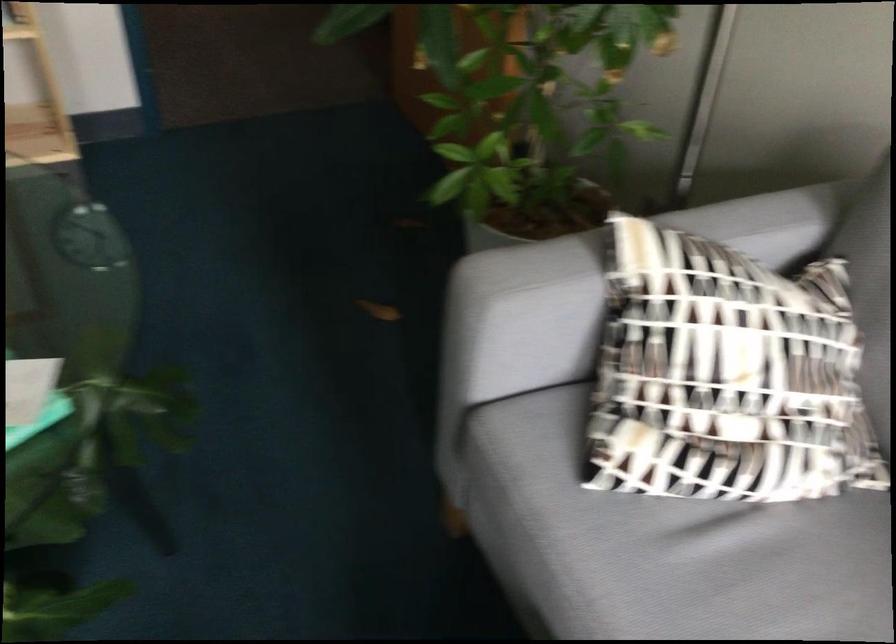
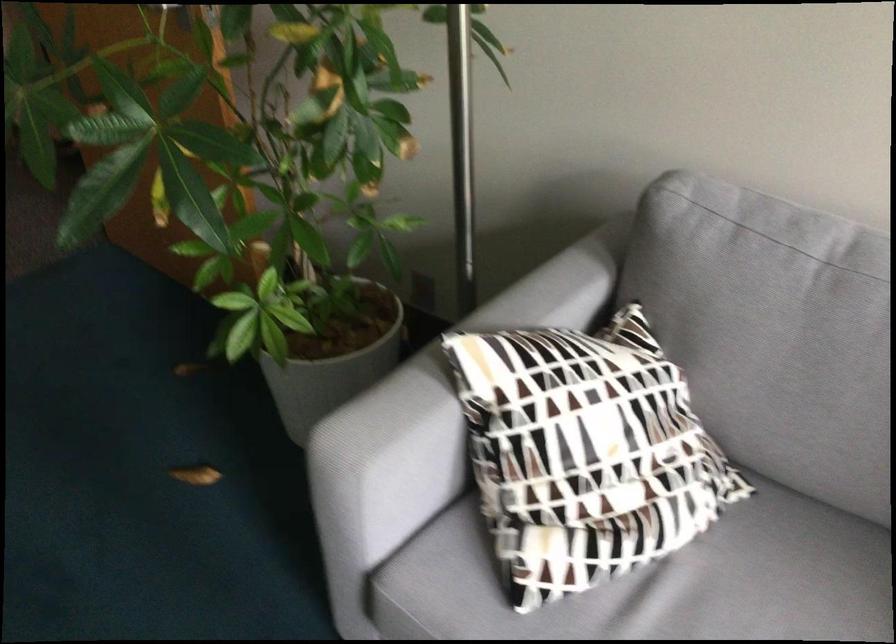
Find the pixel in the second image that matches (x=599, y=272) in the first image.

(444, 397)